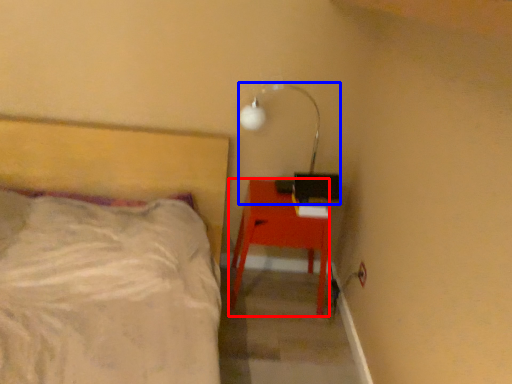
Question: Which object is further to the camera taking this photo, desk (highlighted by a red box) or lamp (highlighted by a blue box)?

Choices:
 (A) desk
 (B) lamp

Answer: (A)